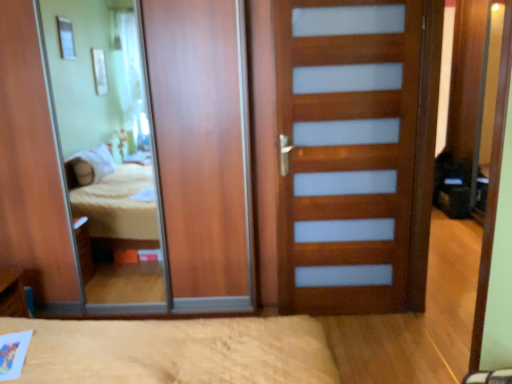
Question: Considering the relative sizes of wooden mirror at center and blue plastic pen at lower left in the image provided, is wooden mirror at center smaller than blue plastic pen at lower left?

Choices:
 (A) no
 (B) yes

Answer: (A)

Question: Is the position of wooden mirror at center less distant than that of blue plastic pen at lower left?

Choices:
 (A) yes
 (B) no

Answer: (B)

Question: Is wooden mirror at center to the right of blue plastic pen at lower left from the viewer's perspective?

Choices:
 (A) no
 (B) yes

Answer: (B)

Question: Does wooden mirror at center turn towards blue plastic pen at lower left?

Choices:
 (A) yes
 (B) no

Answer: (A)

Question: From a real-world perspective, does wooden mirror at center sit lower than blue plastic pen at lower left?

Choices:
 (A) yes
 (B) no

Answer: (B)

Question: Is wooden mirror at center looking in the opposite direction of blue plastic pen at lower left?

Choices:
 (A) yes
 (B) no

Answer: (A)

Question: Considering the relative sizes of blue plastic pen at lower left and wooden mirror at center in the image provided, is blue plastic pen at lower left taller than wooden mirror at center?

Choices:
 (A) no
 (B) yes

Answer: (A)

Question: Does blue plastic pen at lower left appear on the left side of wooden mirror at center?

Choices:
 (A) yes
 (B) no

Answer: (A)

Question: Considering the relative positions of blue plastic pen at lower left and wooden mirror at center in the image provided, is blue plastic pen at lower left to the right of wooden mirror at center from the viewer's perspective?

Choices:
 (A) no
 (B) yes

Answer: (A)

Question: From the image's perspective, is blue plastic pen at lower left located above wooden mirror at center?

Choices:
 (A) yes
 (B) no

Answer: (B)

Question: Is blue plastic pen at lower left positioned beyond the bounds of wooden mirror at center?

Choices:
 (A) yes
 (B) no

Answer: (A)

Question: Is blue plastic pen at lower left closer to the viewer compared to wooden mirror at center?

Choices:
 (A) yes
 (B) no

Answer: (A)

Question: Is blue plastic pen at lower left facing towards wooden door with frosted panels at center?

Choices:
 (A) yes
 (B) no

Answer: (A)